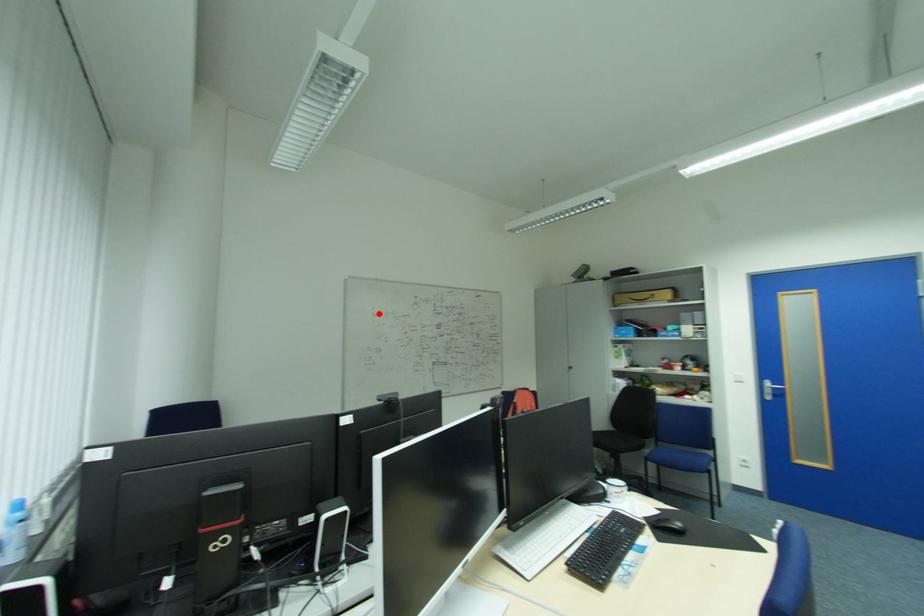
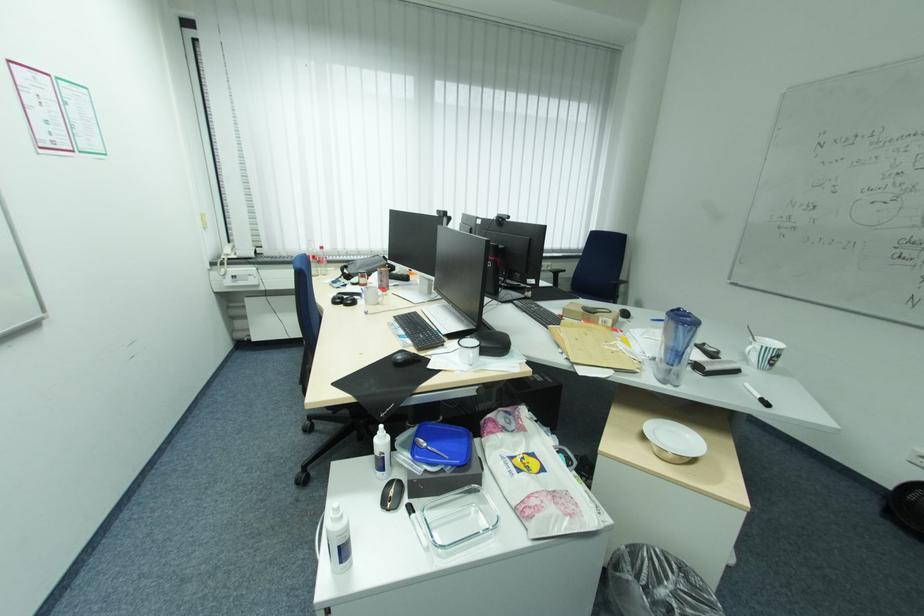
The point at the highlighted location is marked in the first image. Where is the corresponding point in the second image?

(827, 144)